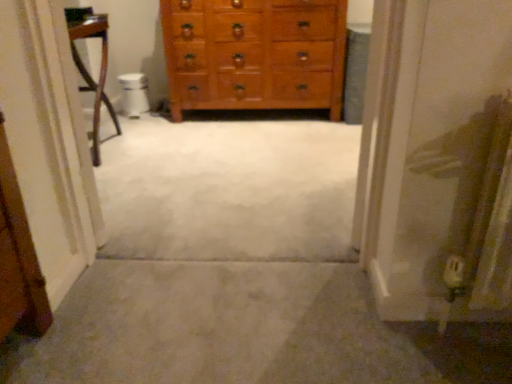
The image size is (512, 384). What are the coordinates of `free spot below white glossy toilet bowl at center (from a real-world perspective)` in the screenshot? It's located at (139, 108).